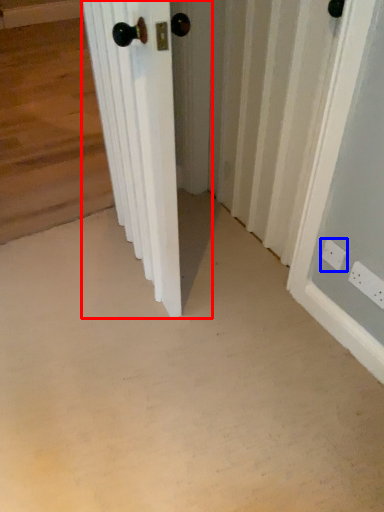
Question: Which of the following is the closest to the observer, door (highlighted by a red box) or electric outlet (highlighted by a blue box)?

Choices:
 (A) door
 (B) electric outlet

Answer: (A)